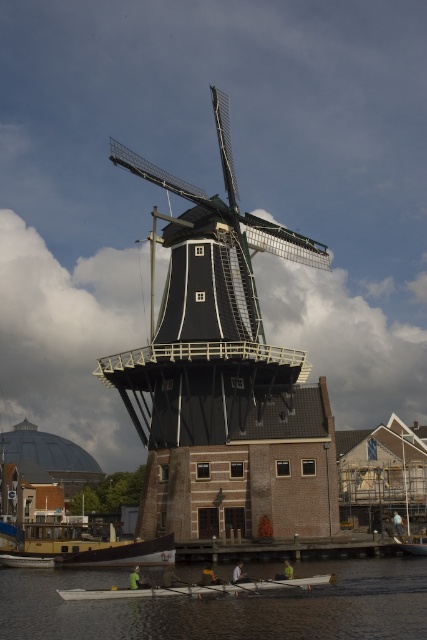
Question: Is transparent water at lower center to the left of brown wooden dock at lower center from the viewer's perspective?

Choices:
 (A) yes
 (B) no

Answer: (A)

Question: Does black wooden windmill at center come behind transparent water at lower center?

Choices:
 (A) no
 (B) yes

Answer: (B)

Question: Estimate the real-world distances between objects in this image. Which object is farther from the brown wooden dock at lower center?

Choices:
 (A) black wooden windmill at center
 (B) white plastic boat at lower center

Answer: (A)

Question: Which object appears closest to the camera in this image?

Choices:
 (A) white plastic boat at lower center
 (B) brown wooden dock at lower center
 (C) transparent water at lower center

Answer: (C)

Question: Which of the following is the farthest from the observer?

Choices:
 (A) (31, 624)
 (B) (322, 538)

Answer: (B)

Question: Is brown wooden dock at lower center wider than white plastic boat at lower center?

Choices:
 (A) no
 (B) yes

Answer: (A)